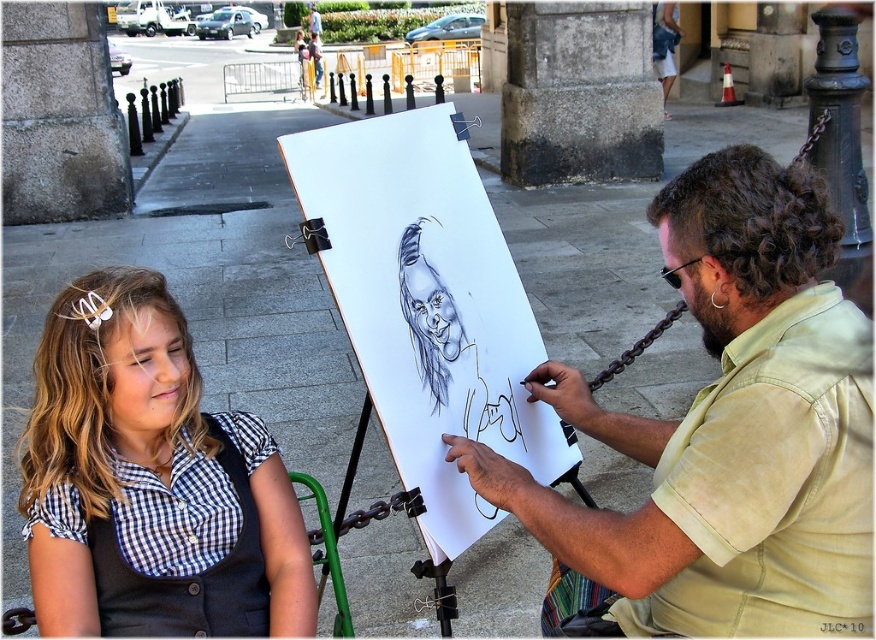
Is point (641, 625) less distant than point (352, 333)?

Yes, point (641, 625) is in front of point (352, 333).

Who is higher up, light beige shirt at center or white paper at center?

light beige shirt at center is above.

Describe the element at coordinates (729, 428) in the screenshot. I see `light beige shirt at center` at that location.

The height and width of the screenshot is (640, 876). In order to click on light beige shirt at center in this screenshot , I will do `click(729, 428)`.

Can you confirm if light beige shirt at center is bigger than checkered fabric at lower left?

Indeed, light beige shirt at center has a larger size compared to checkered fabric at lower left.

The height and width of the screenshot is (640, 876). What are the coordinates of `light beige shirt at center` in the screenshot? It's located at (729, 428).

Which is behind, point (733, 337) or point (232, 602)?

The point (232, 602) is more distant.

This screenshot has width=876, height=640. I want to click on light beige shirt at center, so click(729, 428).

Does checkered fabric at lower left lie in front of white paper at center?

Yes, checkered fabric at lower left is in front of white paper at center.

The width and height of the screenshot is (876, 640). What are the coordinates of `checkered fabric at lower left` in the screenshot? It's located at (150, 481).